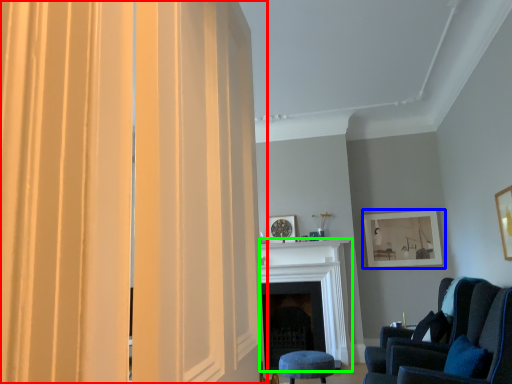
Question: Based on their relative distances, which object is nearer to curtain (highlighted by a red box)? Choose from picture frame (highlighted by a blue box) and fireplace (highlighted by a green box).

Choices:
 (A) picture frame
 (B) fireplace

Answer: (B)